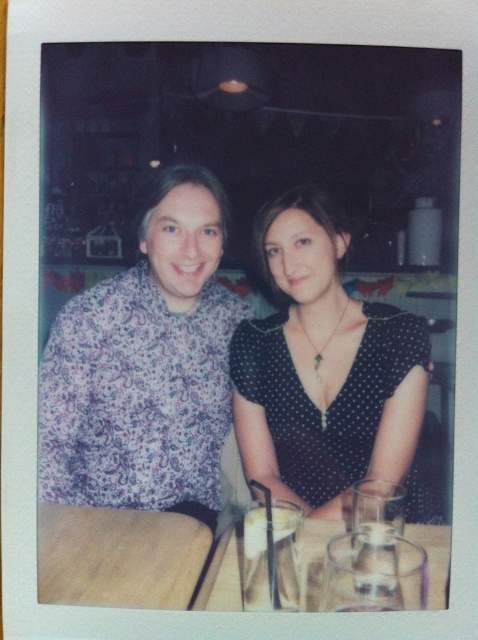
You are a photographer trying to capture a closeup of the clear glass table at center in the Polaroid photo. However, the black dotted dress at center is blocking your view. Can you estimate whether the dress is taller or shorter than the table?

The black dotted dress at center has a greater height compared to clear glass table at center, so the dress is taller than the table and is blocking the view.

You are a photographer trying to capture a closeup of the black dotted dress at center and the wooden table at lower left. Which object should you focus on first if you want to ensure both are in focus without adjusting the camera settings?

The wooden table at lower left is closer to the camera than the black dotted dress at center, so focusing on the wooden table at lower left first would allow both objects to be in focus when using a shallow depth of field.

Consider the image. You are a photographer trying to capture a closeup shot of the clear glass table at center. You have a camera with a 16 inch focal length. Considering the polka dot dress at center is nearby, will the dress interfere with your shot?

The polka dot dress at center is only 18.96 inches away from the clear glass table at center. Since the camera requires a 16 inch focal length, the dress is close enough to potentially interfere with the shot. You may need to adjust your position or angle to avoid obstruction.